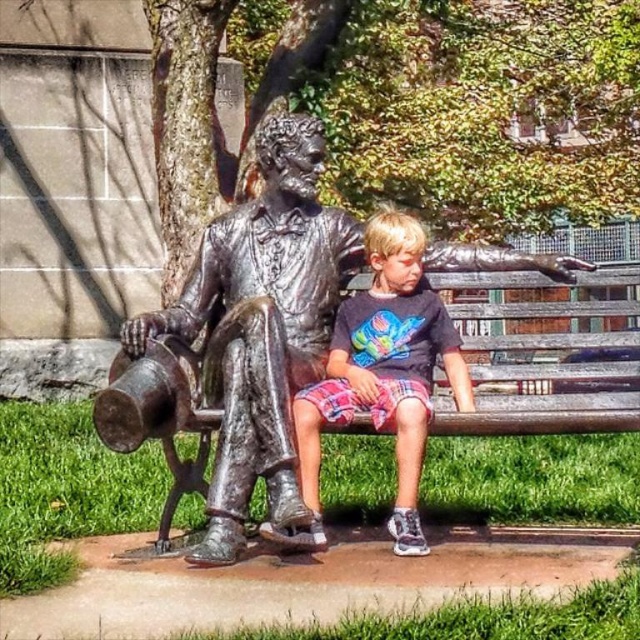
Where is `bronze statue at center`? This screenshot has height=640, width=640. bronze statue at center is located at coordinates pyautogui.click(x=248, y=333).

The width and height of the screenshot is (640, 640). Find the location of `bronze statue at center`. bronze statue at center is located at coordinates (248, 333).

At what (x,y) coordinates should I click in order to perform the action: click on bronze statue at center. Please return your answer as a coordinate pair (x, y). The width and height of the screenshot is (640, 640). Looking at the image, I should click on (248, 333).